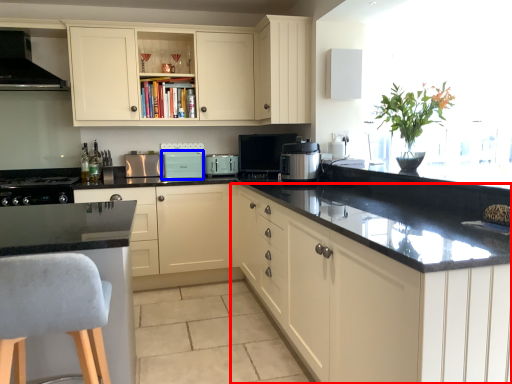
Question: Which object appears closest to the camera in this image, cabinetry (highlighted by a red box) or appliance (highlighted by a blue box)?

Choices:
 (A) cabinetry
 (B) appliance

Answer: (A)